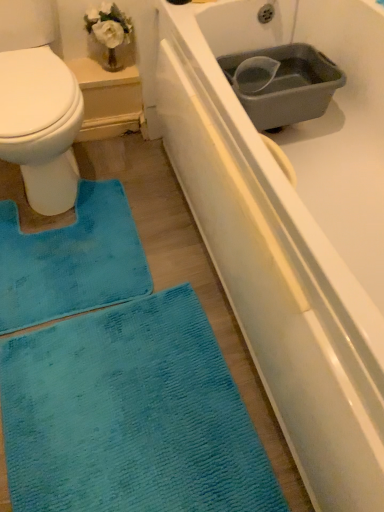
Question: Is teal soft rug at lower left inside or outside of white matte bathtub at center?

Choices:
 (A) outside
 (B) inside

Answer: (B)

Question: In the image, is teal soft rug at lower left on the left side or the right side of white matte bathtub at center?

Choices:
 (A) right
 (B) left

Answer: (B)

Question: Which object is the closest to the blue textured mat at lower left?

Choices:
 (A) white matte bathtub at center
 (B) gray plastic basin at upper right
 (C) teal soft rug at lower left
 (D) blue fabric bidet at lower left

Answer: (D)

Question: Considering the real-world distances, which object is closest to the teal soft rug at lower left?

Choices:
 (A) gray plastic basin at upper right
 (B) white matte bathtub at center
 (C) blue fabric bidet at lower left
 (D) blue textured mat at lower left

Answer: (D)